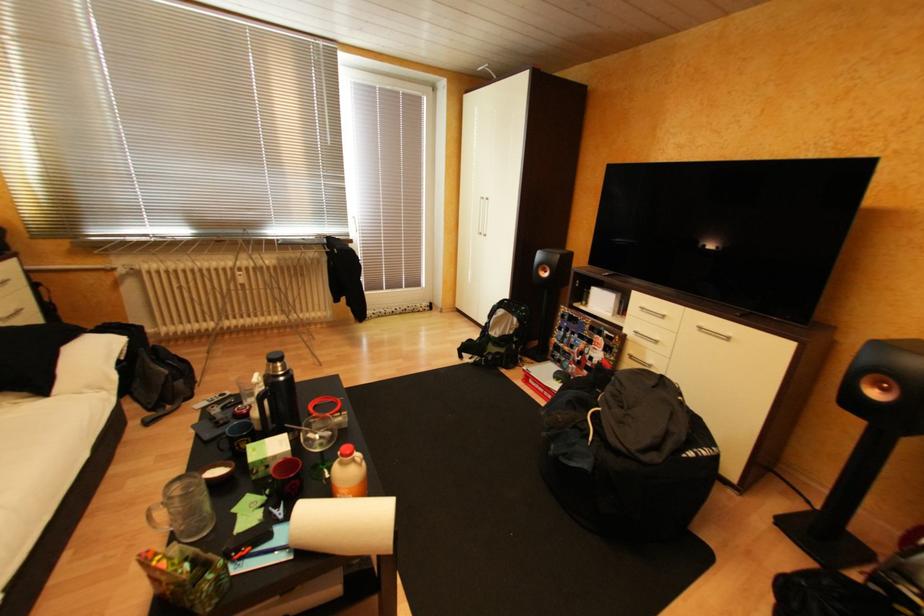
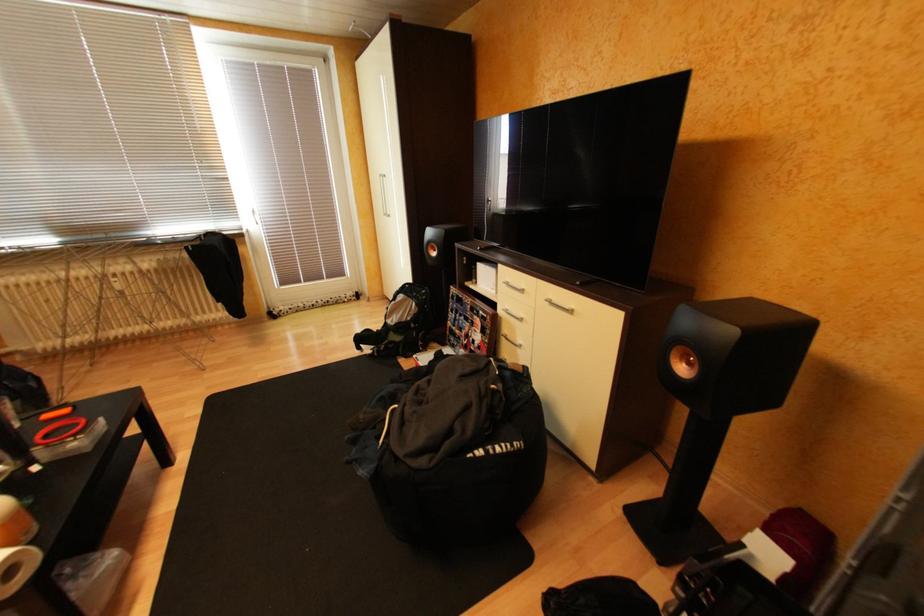
Question: How did the camera likely rotate?

Choices:
 (A) Left
 (B) Right
 (C) Up
 (D) Down

Answer: (D)